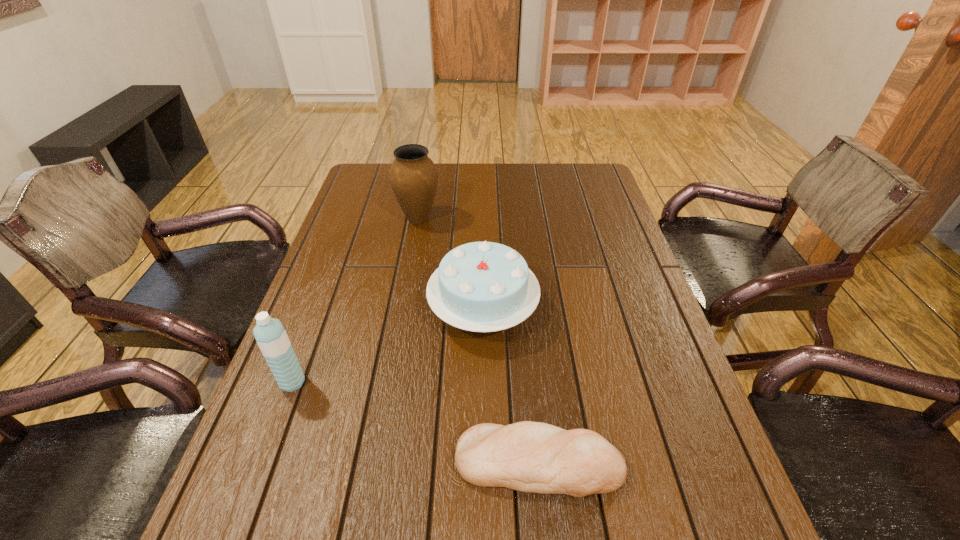
This screenshot has width=960, height=540. I want to click on the farthest object, so click(x=413, y=176).

I want to click on the leftmost object, so click(270, 335).

What are the coordinates of `the second nearest object` in the screenshot? It's located at (270, 335).

Find the location of `the third tallest object`. the third tallest object is located at coordinates (484, 286).

Locate an element on the screen. This screenshot has height=540, width=960. birthday cake is located at coordinates (484, 286).

The width and height of the screenshot is (960, 540). I want to click on bread, so click(533, 457).

The width and height of the screenshot is (960, 540). In order to click on the shortest object in this screenshot , I will do `click(533, 457)`.

Find the location of `vacant space located on the back of the urn`. vacant space located on the back of the urn is located at coordinates (423, 192).

Locate an element on the screen. This screenshot has width=960, height=540. free space located on the right of the water bottle is located at coordinates (337, 382).

Locate an element on the screen. This screenshot has width=960, height=540. vacant space located on the front of the third tallest object is located at coordinates (484, 370).